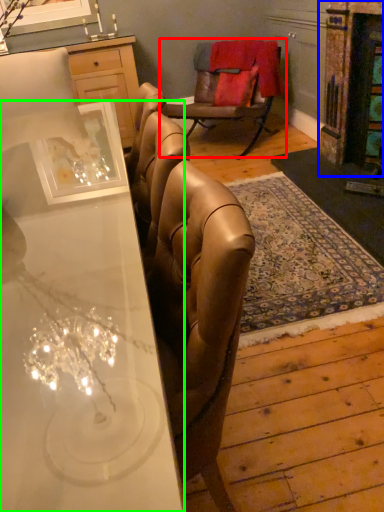
Question: Considering the real-world distances, which object is farthest from chair (highlighted by a red box)? fireplace (highlighted by a blue box) or desk (highlighted by a green box)?

Choices:
 (A) fireplace
 (B) desk

Answer: (B)